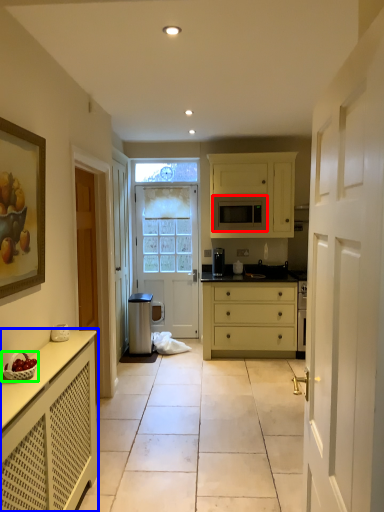
Question: Which object is positioned closest to microwave oven (highlighted by a red box)? Select from cabinetry (highlighted by a blue box) and fruit dish (highlighted by a green box).

Choices:
 (A) cabinetry
 (B) fruit dish

Answer: (A)